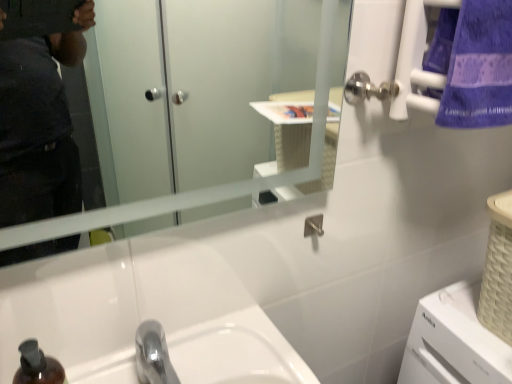
The width and height of the screenshot is (512, 384). Find the location of `free point above chrome metallic sink at center (from a real-world perspective)`. free point above chrome metallic sink at center (from a real-world perspective) is located at coordinates (216, 357).